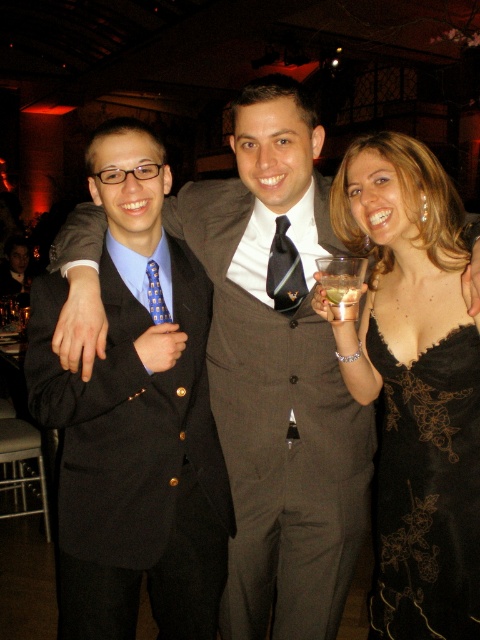
Question: Which is farther from the blue dotted tie at center?

Choices:
 (A) black satin suit at left
 (B) black lace dress at lower right
 (C) black silk tie at center

Answer: (B)

Question: Can you confirm if black satin suit at left is positioned to the right of matte black suit at center?

Choices:
 (A) no
 (B) yes

Answer: (B)

Question: Which point is farther from the camera taking this photo?

Choices:
 (A) (409, 579)
 (B) (288, 257)
 (C) (429, 262)

Answer: (B)

Question: Is clear plastic wine glass at center wider than matte black suit at center?

Choices:
 (A) no
 (B) yes

Answer: (A)

Question: Considering the relative positions of black lace dress at lower right and clear plastic wine glass at center in the image provided, where is black lace dress at lower right located with respect to clear plastic wine glass at center?

Choices:
 (A) below
 (B) above

Answer: (A)

Question: Among these objects, which one is nearest to the camera?

Choices:
 (A) black satin dress at center
 (B) black satin suit at left
 (C) matte black suit at center

Answer: (A)